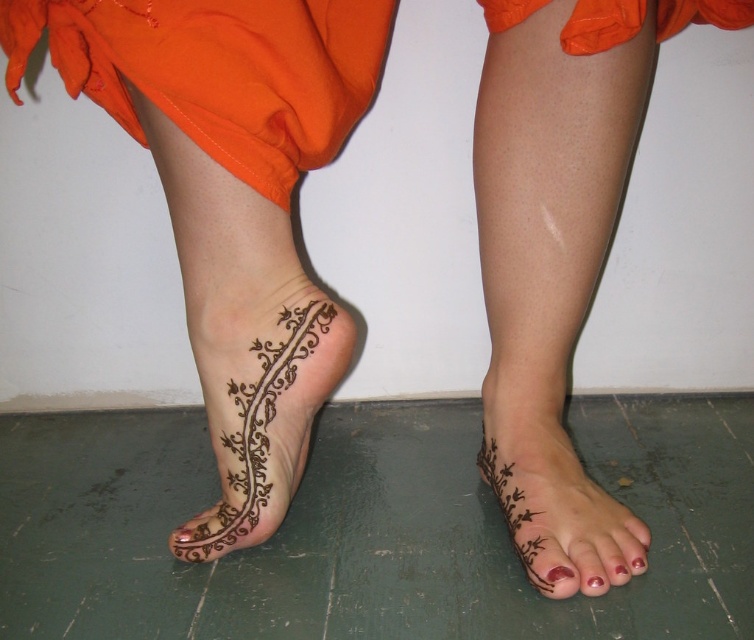
Question: Which point appears farthest from the camera in this image?

Choices:
 (A) (581, 580)
 (B) (532, 481)
 (C) (210, 385)

Answer: (B)

Question: Which object is positioned closest to the glossy red nail polish at lower center?

Choices:
 (A) brown henna tattoo at lower left
 (B) brown henna tattoo at lower center

Answer: (B)

Question: Is brown henna tattoo at lower left above brown henna tattoo at lower center?

Choices:
 (A) no
 (B) yes

Answer: (B)

Question: Does brown henna tattoo at lower center appear on the left side of glossy red nail polish at lower center?

Choices:
 (A) no
 (B) yes

Answer: (B)

Question: Among these points, which one is farthest from the camera?

Choices:
 (A) (584, 554)
 (B) (578, 550)

Answer: (B)

Question: Considering the relative positions of brown henna tattoo at lower left and brown henna tattoo at lower center in the image provided, where is brown henna tattoo at lower left located with respect to brown henna tattoo at lower center?

Choices:
 (A) right
 (B) left

Answer: (B)